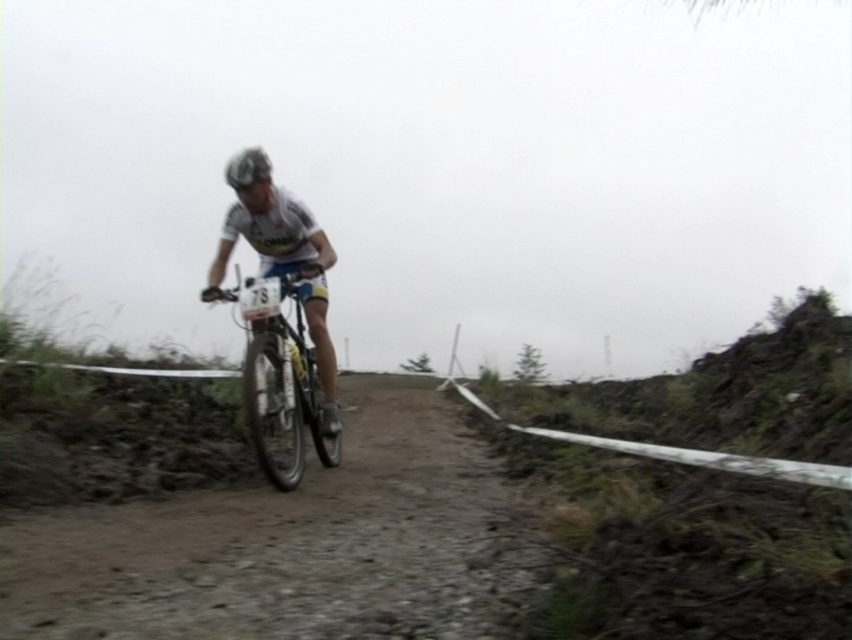
Question: Is shiny metallic bicycle at center above shiny silver helmet at center?

Choices:
 (A) no
 (B) yes

Answer: (A)

Question: Is shiny metallic bicycle at center further to camera compared to shiny silver helmet at center?

Choices:
 (A) no
 (B) yes

Answer: (A)

Question: Does shiny metallic bicycle at center have a lesser width compared to shiny silver helmet at center?

Choices:
 (A) no
 (B) yes

Answer: (B)